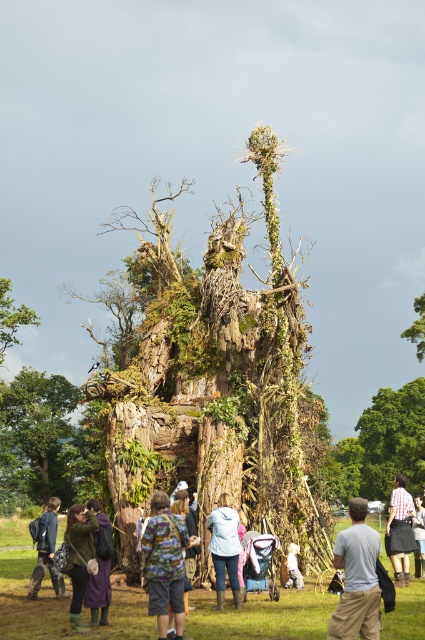
Which is behind, point (404, 577) or point (96, 538)?

Positioned behind is point (404, 577).

You are a GUI agent. You are given a task and a screenshot of the screen. Output one action in this format:
    pyautogui.click(x=<x>, y=<y>)
    Task: Click on the plaid shirt at center
    This screenshot has width=425, height=640.
    Given the screenshot: What is the action you would take?
    pyautogui.click(x=399, y=531)

You are a GUI agent. You are given a task and a screenshot of the screen. Output one action in this format:
    pyautogui.click(x=<x>, y=<y>)
    Task: Click on the plaid shirt at center
    
    Given the screenshot: What is the action you would take?
    pyautogui.click(x=399, y=531)

Who is higher up, rusty wood sculpture at center or green leafy tree at upper left?

rusty wood sculpture at center is above.

From the picture: Is rusty wood sculpture at center wider than green leafy tree at upper left?

Yes.

This screenshot has width=425, height=640. In order to click on rusty wood sculpture at center in this screenshot , I will do `click(220, 378)`.

Is green leafy tree at upper left positioned in front of light blue denim jacket at center?

No, it is not.

This screenshot has height=640, width=425. I want to click on green leafy tree at upper left, so click(11, 317).

Between point (22, 314) and point (289, 579), which one is positioned in front?

Point (289, 579) is in front.

Where is `green leafy tree at upper left`? green leafy tree at upper left is located at coordinates (11, 317).